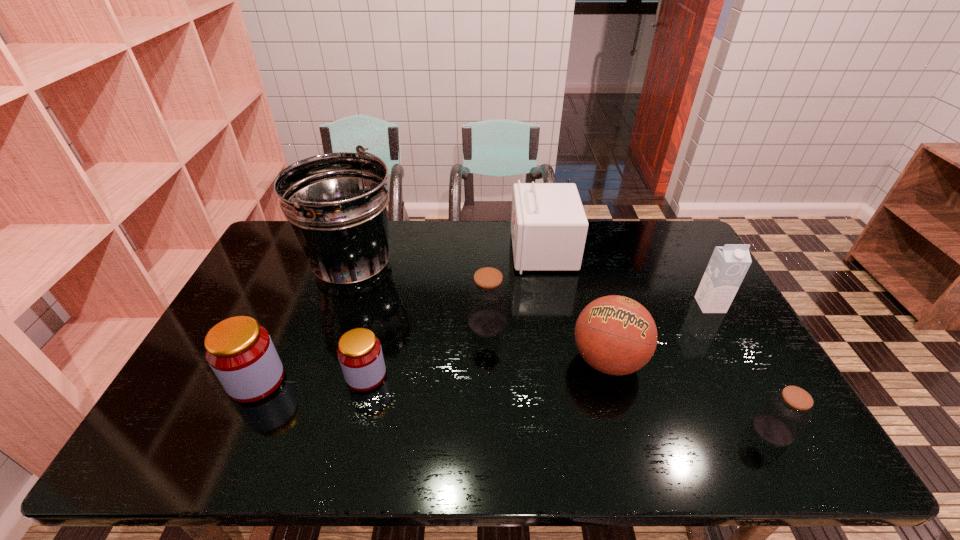
Image resolution: width=960 pixels, height=540 pixels. I want to click on vacant area situated 0.290m on the right of the smaller red jar, so click(x=497, y=375).

I want to click on free space located on the back of the nearest jar, so click(x=717, y=328).

The width and height of the screenshot is (960, 540). In order to click on bucket positioned at the far edge in this screenshot , I will do `click(337, 203)`.

This screenshot has width=960, height=540. Identify the location of the first-aid kit that is at the far edge. (549, 227).

You are a GUI agent. You are given a task and a screenshot of the screen. Output one action in this format:
    pyautogui.click(x=<x>, y=<y>)
    Task: Click on the object present at the near edge
    The image size is (960, 540).
    Given the screenshot: What is the action you would take?
    pyautogui.click(x=785, y=413)

Identify the location of object at the left edge. (240, 352).

Where is `carton at the right edge`? Image resolution: width=960 pixels, height=540 pixels. carton at the right edge is located at coordinates (728, 265).

What are the coordinates of `jar situated at the right edge` in the screenshot? It's located at (785, 413).

This screenshot has width=960, height=540. I want to click on object located in the near right corner section of the desktop, so click(x=785, y=413).

Locate an element on the screen. vacant position at the far edge of the desktop is located at coordinates (398, 254).